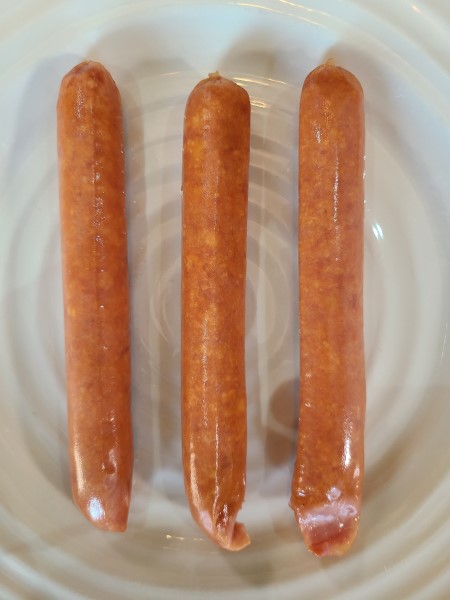
Where is `white round plate`? This screenshot has width=450, height=600. white round plate is located at coordinates (400, 481).